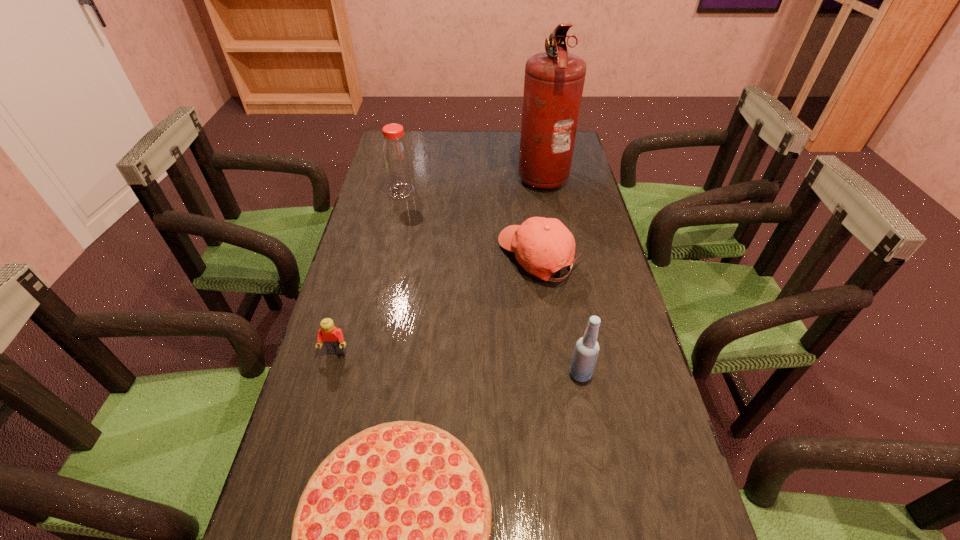
What are the coordinates of `bottle present at the right edge` in the screenshot? It's located at (584, 358).

The height and width of the screenshot is (540, 960). I want to click on baseball cap that is positioned at the right edge, so click(x=542, y=246).

At what (x,y) coordinates should I click in order to perform the action: click on object that is positioned at the far right corner. Please return your answer as a coordinate pair (x, y). Looking at the image, I should click on (554, 80).

The width and height of the screenshot is (960, 540). What are the coordinates of `vacant space at the far edge of the desktop` in the screenshot? It's located at (440, 142).

Locate an element on the screen. Image resolution: width=960 pixels, height=540 pixels. vacant space at the left edge of the desktop is located at coordinates (x=320, y=393).

Find the location of a particular element. Image resolution: width=960 pixels, height=540 pixels. free space at the right edge of the desktop is located at coordinates (663, 444).

Where is `vacant area between the tallest object and the third farthest object`? This screenshot has width=960, height=540. vacant area between the tallest object and the third farthest object is located at coordinates (540, 216).

You are a GUI agent. You are given a task and a screenshot of the screen. Output one action in this format:
    pyautogui.click(x=<x>, y=<y>)
    Task: Click on the free point between the third tallest object and the fourth farthest object
    
    Given the screenshot: What is the action you would take?
    pyautogui.click(x=458, y=363)

Locate an element on the screen. Image resolution: width=960 pixels, height=540 pixels. vacant point located between the third nearest object and the third shortest object is located at coordinates (437, 304).

Where is `free space between the shorter bottle and the fire extinguisher`? free space between the shorter bottle and the fire extinguisher is located at coordinates (561, 274).